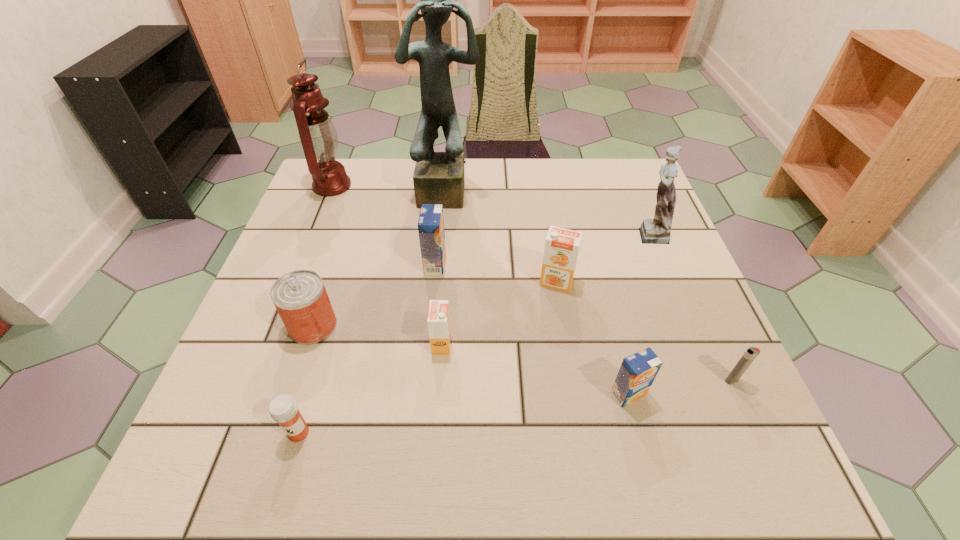
In order to click on vacant space at the near edge of the desktop in this screenshot , I will do `click(610, 447)`.

Where is `vacant point at the left edge`? The image size is (960, 540). vacant point at the left edge is located at coordinates (296, 222).

The image size is (960, 540). Identify the location of free space at the right edge of the desktop. (648, 255).

In the image, there is a desktop. Where is `vacant space at the far left corner`? vacant space at the far left corner is located at coordinates (366, 176).

You are a GUI agent. You are given a task and a screenshot of the screen. Output one action in this format:
    pyautogui.click(x=<x>, y=<y>)
    Task: Click on the vacant area at the far right corner of the desktop
    
    Given the screenshot: What is the action you would take?
    pyautogui.click(x=633, y=164)

At what (x,y) coordinates should I click in order to perform the action: click on vacant area that lies between the igniter and the nearest object. Please return your answer as a coordinate pair (x, y). This screenshot has width=960, height=540. Looking at the image, I should click on (x=516, y=407).

Find the location of `free spot between the can and the oil lamp`. free spot between the can and the oil lamp is located at coordinates (323, 256).

I want to click on vacant space that is in between the oil lamp and the tallest object, so click(x=390, y=188).

This screenshot has height=540, width=960. I want to click on free spot between the medicine and the sculpture, so pyautogui.click(x=373, y=312).

In order to click on empty space that is in between the figurine and the red oil lamp in this screenshot , I will do `click(491, 210)`.